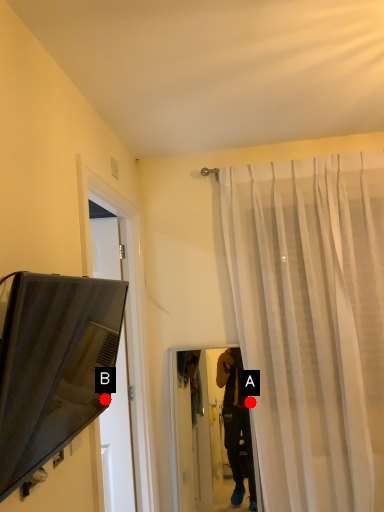
Question: Two points are circled on the image, labeled by A and B beside each circle. Which point appears farthest from the camera in this image?

Choices:
 (A) A is further
 (B) B is further

Answer: (A)